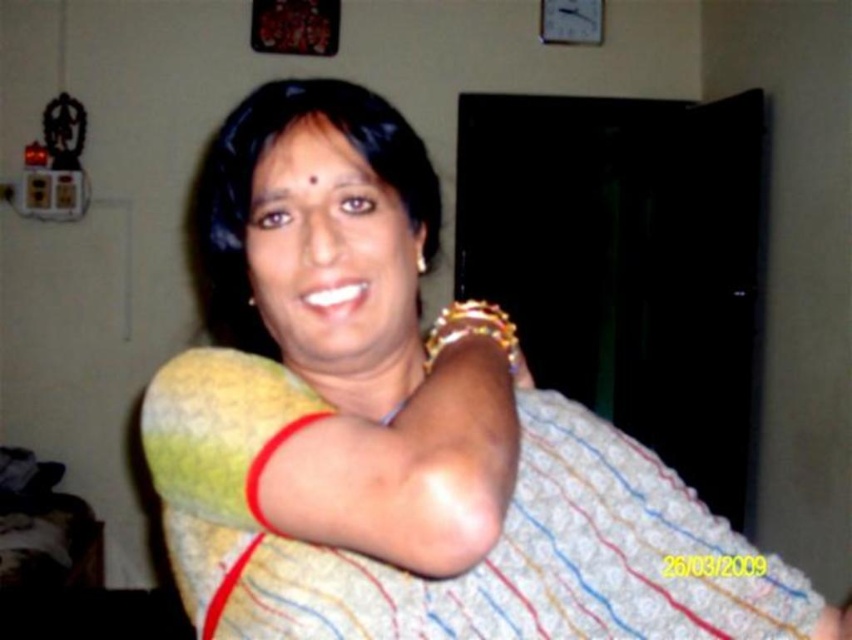
Is point (275, 298) positioned before point (453, 326)?

Yes, it is in front of point (453, 326).

Is yellow fabric at center shorter than gold shiny bracelet at upper right?

In fact, yellow fabric at center may be taller than gold shiny bracelet at upper right.

Which is behind, point (268, 628) or point (436, 352)?

Point (436, 352)

The image size is (852, 640). Find the location of `yellow fabric at center`. yellow fabric at center is located at coordinates (404, 429).